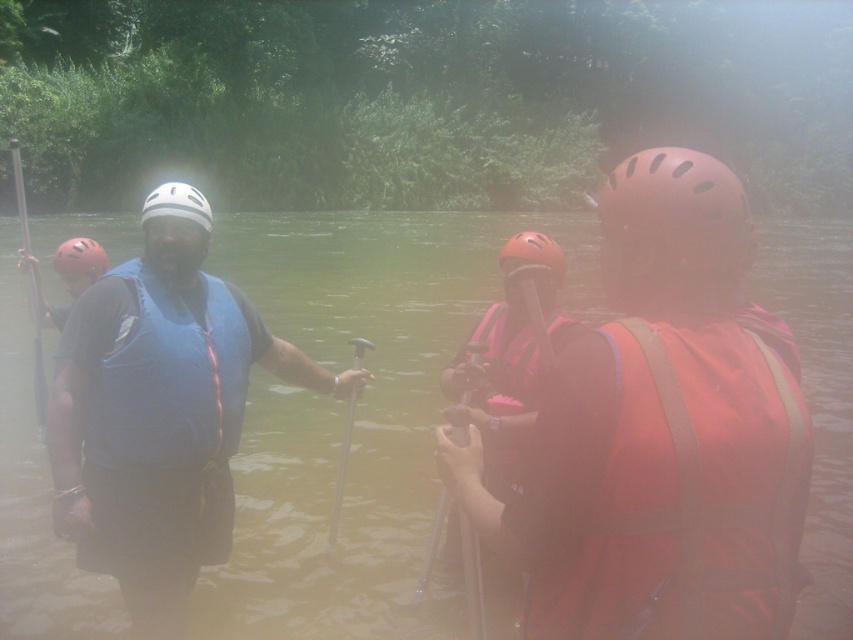
Question: Which of these objects is positioned closest to the metallic silver paddle at center?

Choices:
 (A) white matte helmet at center
 (B) matte red life jacket at right

Answer: (B)

Question: Which of the following is the closest to the observer?

Choices:
 (A) (465, 518)
 (B) (752, 371)
 (C) (498, 372)

Answer: (B)

Question: Among these objects, which one is farthest from the camera?

Choices:
 (A) blue fabric life vest at left
 (B) matte red helmet at left

Answer: (B)

Question: Is matte red life jacket at right above metallic silver paddle at center?

Choices:
 (A) no
 (B) yes

Answer: (B)

Question: Observing the image, what is the correct spatial positioning of smooth plastic paddle at left in reference to white matte helmet at center?

Choices:
 (A) below
 (B) above

Answer: (A)

Question: Considering the relative positions of matte red helmet at left and white matte helmet at center in the image provided, where is matte red helmet at left located with respect to white matte helmet at center?

Choices:
 (A) right
 (B) left

Answer: (A)